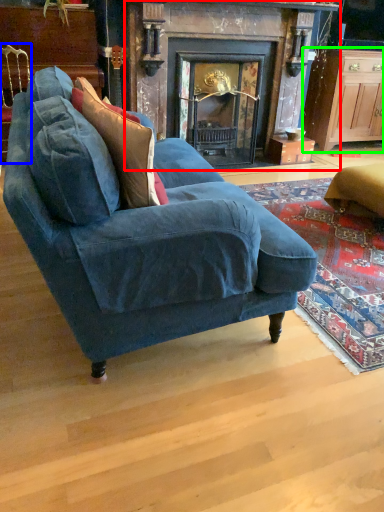
Question: Considering the real-world distances, which object is closest to fireplace (highlighted by a red box)? chair (highlighted by a blue box) or cabinetry (highlighted by a green box).

Choices:
 (A) chair
 (B) cabinetry

Answer: (B)